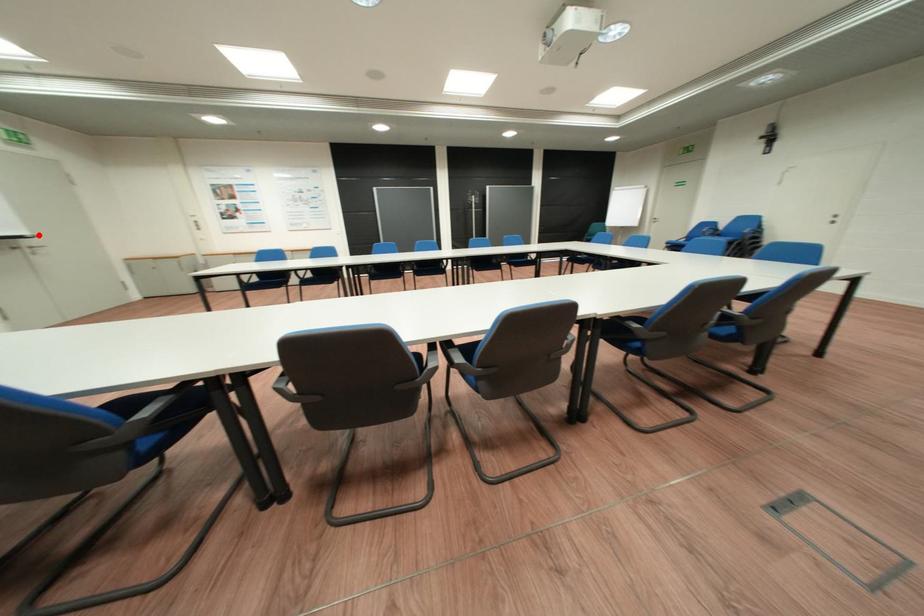
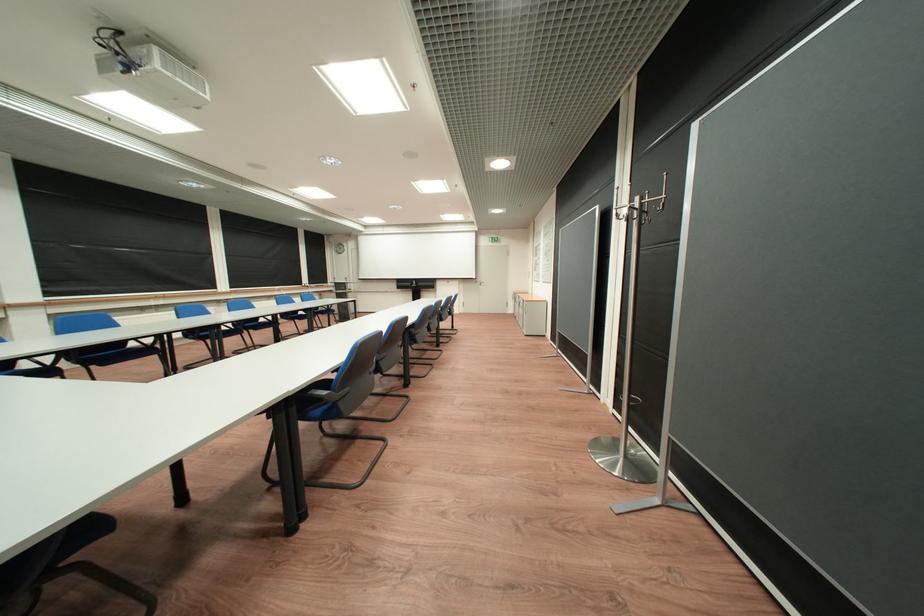
Find the pixel in the second image that matches the highlighted location in the first image.

(487, 278)